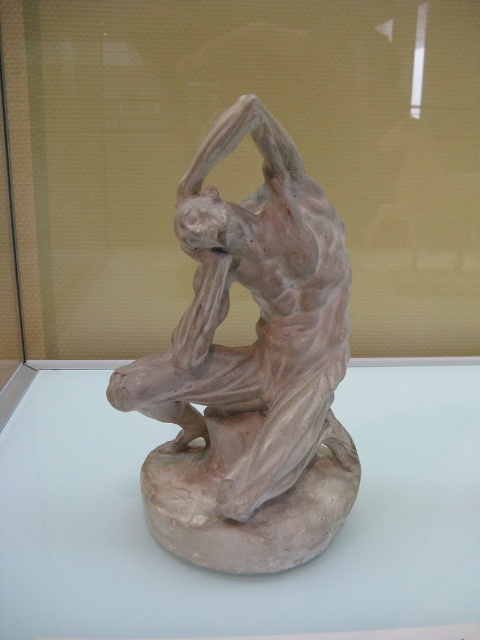
Question: Does matte clay sculpture at center have a smaller size compared to matte clay figure at center?

Choices:
 (A) no
 (B) yes

Answer: (A)

Question: Is matte clay sculpture at center thinner than matte clay figure at center?

Choices:
 (A) no
 (B) yes

Answer: (A)

Question: Among these objects, which one is farthest from the camera?

Choices:
 (A) matte clay sculpture at center
 (B) matte clay figure at center

Answer: (B)

Question: Can you confirm if matte clay sculpture at center is positioned above matte clay figure at center?

Choices:
 (A) yes
 (B) no

Answer: (B)